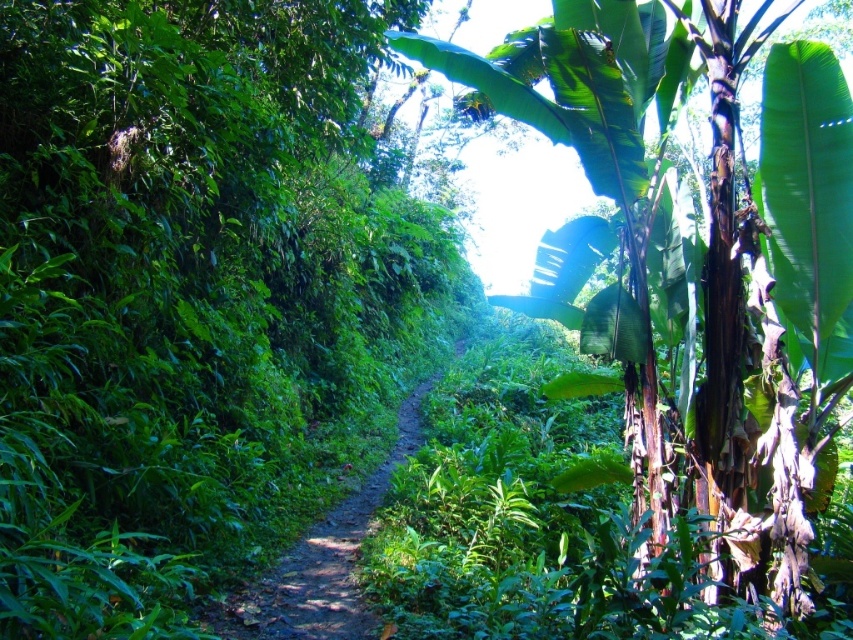
Question: Is green leafy banana tree at right closer to camera compared to dirt path at center?

Choices:
 (A) yes
 (B) no

Answer: (A)

Question: Can you confirm if green leafy banana tree at right is positioned to the left of dirt path at center?

Choices:
 (A) no
 (B) yes

Answer: (A)

Question: Among these objects, which one is farthest from the camera?

Choices:
 (A) dirt path at center
 (B) green leafy banana tree at right

Answer: (A)

Question: Can you confirm if green leafy banana tree at right is positioned to the left of dirt path at center?

Choices:
 (A) yes
 (B) no

Answer: (B)

Question: Which of the following is the closest to the observer?

Choices:
 (A) (352, 614)
 (B) (798, 573)

Answer: (B)

Question: Which point is farther from the camera taking this photo?

Choices:
 (A) (730, 413)
 (B) (331, 628)

Answer: (A)